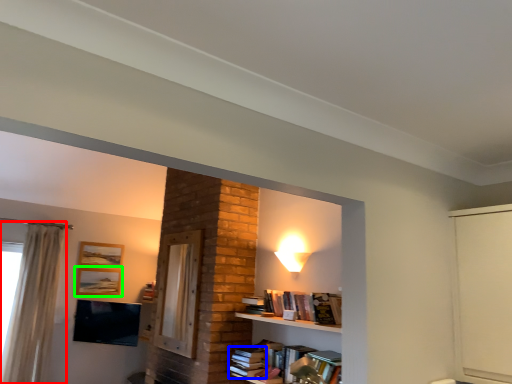
Question: Based on their relative distances, which object is farther from curtain (highlighted by a red box)? Choose from book (highlighted by a blue box) and picture frame (highlighted by a green box).

Choices:
 (A) book
 (B) picture frame

Answer: (A)